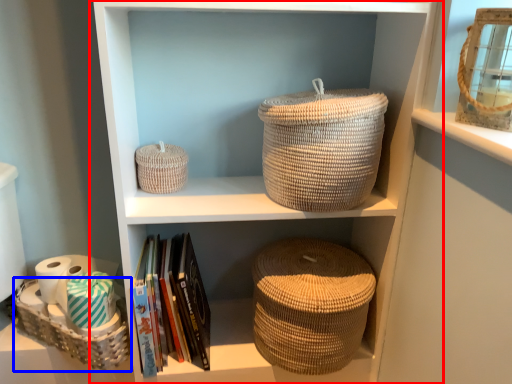
Question: Which point is further to the camera, shelf (highlighted by a red box) or basket (highlighted by a blue box)?

Choices:
 (A) shelf
 (B) basket

Answer: (B)